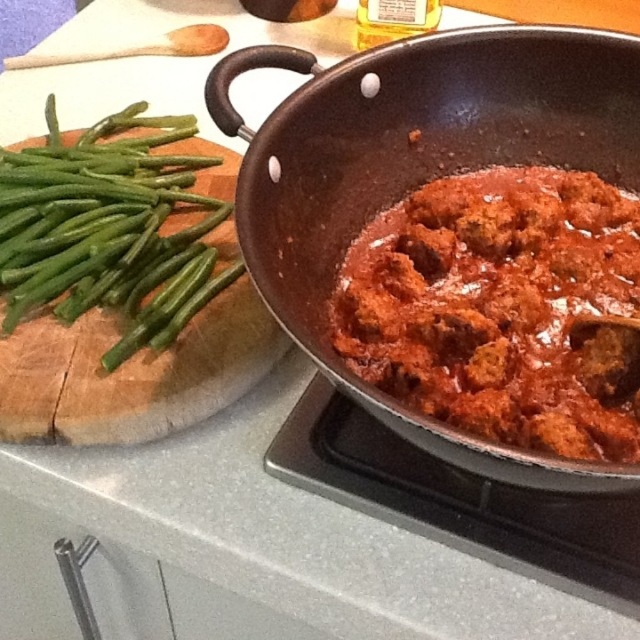
Which is in front, point (298, 180) or point (1, 248)?

Point (298, 180) is in front.

Does dark brown matte wok at right have a lesser height compared to green smooth/woody green beans at left?

No.

You are a GUI agent. You are given a task and a screenshot of the screen. Output one action in this format:
    pyautogui.click(x=<x>, y=<y>)
    Task: Click on the dark brown matte wok at right
    The image size is (640, 640).
    Given the screenshot: What is the action you would take?
    pyautogui.click(x=420, y=179)